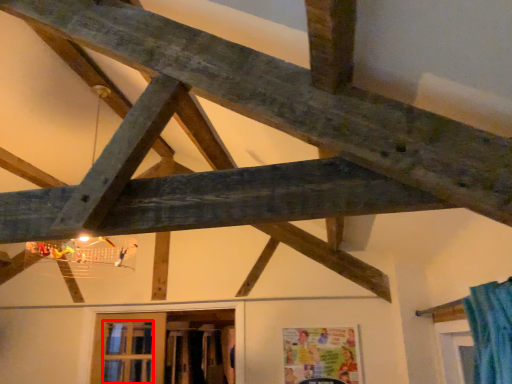
Question: Considering the relative positions of window (annotated by the red box) and window in the image provided, where is window (annotated by the red box) located with respect to the staircase?

Choices:
 (A) left
 (B) right

Answer: (A)